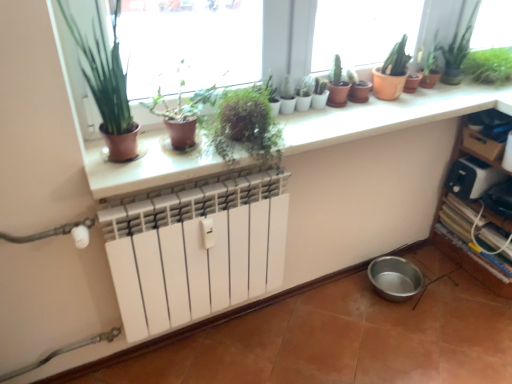
Question: Is wooden shelf at lower right facing towards green glossy plant at upper right?

Choices:
 (A) no
 (B) yes

Answer: (A)

Question: Is wooden shelf at lower right closer to camera compared to green glossy plant at upper right?

Choices:
 (A) yes
 (B) no

Answer: (A)

Question: Is wooden shelf at lower right to the left of green glossy plant at upper right from the viewer's perspective?

Choices:
 (A) yes
 (B) no

Answer: (B)

Question: Is wooden shelf at lower right far away from green glossy plant at upper right?

Choices:
 (A) yes
 (B) no

Answer: (B)

Question: Is wooden shelf at lower right thinner than green glossy plant at upper right?

Choices:
 (A) yes
 (B) no

Answer: (B)

Question: From the image's perspective, relative to green matte cactus at center, which is the fourth houseplant in left-to-right order, is green glossy plant at upper right above or below?

Choices:
 (A) above
 (B) below

Answer: (A)

Question: From a real-world perspective, is green glossy plant at upper right physically located above or below green matte cactus at center, the third houseplant viewed from the right?

Choices:
 (A) below
 (B) above

Answer: (B)

Question: From their relative heights in the image, would you say green glossy plant at upper right is taller or shorter than green matte cactus at center, which is the fourth houseplant in left-to-right order?

Choices:
 (A) tall
 (B) short

Answer: (A)

Question: Based on their sizes in the image, would you say green glossy plant at upper right is bigger or smaller than green matte cactus at center, which is the fourth houseplant in left-to-right order?

Choices:
 (A) big
 (B) small

Answer: (A)

Question: From a real-world perspective, relative to green matte plant at upper center, marked as the 3th houseplant in a left-to-right arrangement, is green matte cactus at center, which is the fourth houseplant in left-to-right order, vertically above or below?

Choices:
 (A) below
 (B) above

Answer: (B)

Question: In the image, is green matte cactus at center, which is the fourth houseplant in left-to-right order, positioned in front of or behind green matte plant at upper center, marked as the 3th houseplant in a left-to-right arrangement?

Choices:
 (A) behind
 (B) front

Answer: (A)

Question: Considering the positions of point (337, 54) and point (232, 152), is point (337, 54) closer or farther from the camera than point (232, 152)?

Choices:
 (A) farther
 (B) closer

Answer: (A)

Question: Is green matte cactus at center, which is the fourth houseplant in left-to-right order, to the left or to the right of green matte plant at upper center, arranged as the fourth houseplant when viewed from the right, in the image?

Choices:
 (A) right
 (B) left

Answer: (A)

Question: From their relative heights in the image, would you say terracotta clay pots at upper center is taller or shorter than white plastic toaster at right?

Choices:
 (A) short
 (B) tall

Answer: (A)

Question: Visually, is terracotta clay pots at upper center positioned to the left or to the right of white plastic toaster at right?

Choices:
 (A) left
 (B) right

Answer: (A)